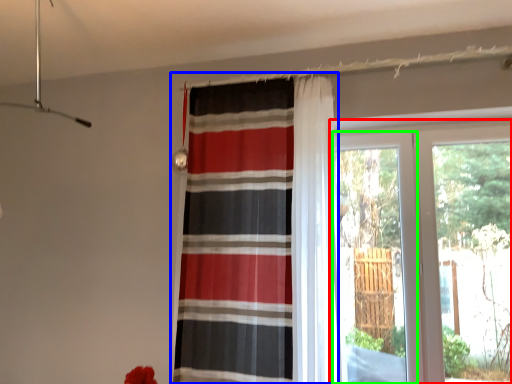
Question: Estimate the real-world distances between objects in this image. Which object is closer to window (highlighted by a red box), curtain (highlighted by a blue box) or screen door (highlighted by a green box)?

Choices:
 (A) curtain
 (B) screen door

Answer: (B)